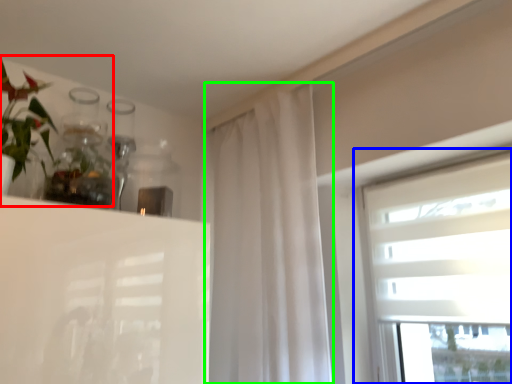
Question: Based on their relative distances, which object is nearer to floral arrangement (highlighted by a red box)? Choose from window (highlighted by a blue box) and curtain (highlighted by a green box).

Choices:
 (A) window
 (B) curtain

Answer: (B)